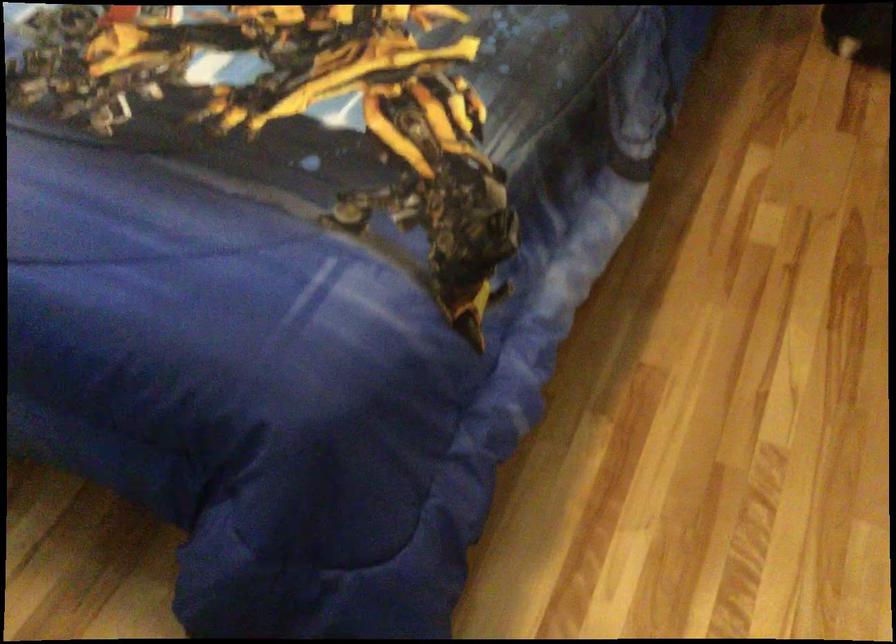
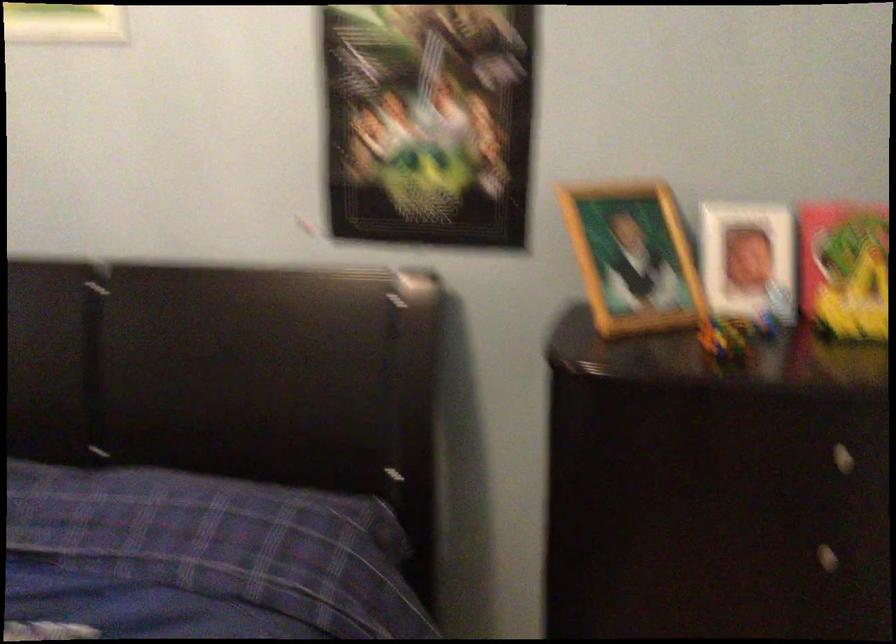
Looking at this image, first-person continuous shooting, in which direction is the camera rotating?

The rotation direction of the camera is right-up.